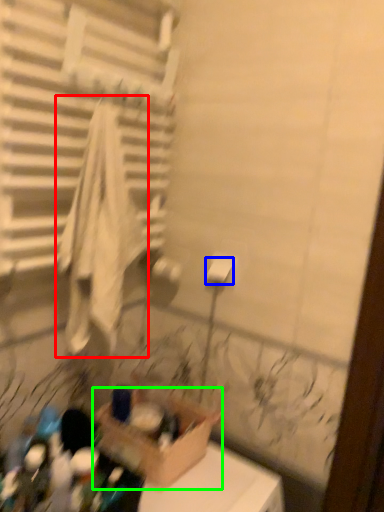
Question: Which is nearer to the bath towel (highlighted by a red box)? toilet paper (highlighted by a blue box) or cardboard box (highlighted by a green box).

Choices:
 (A) toilet paper
 (B) cardboard box

Answer: (A)